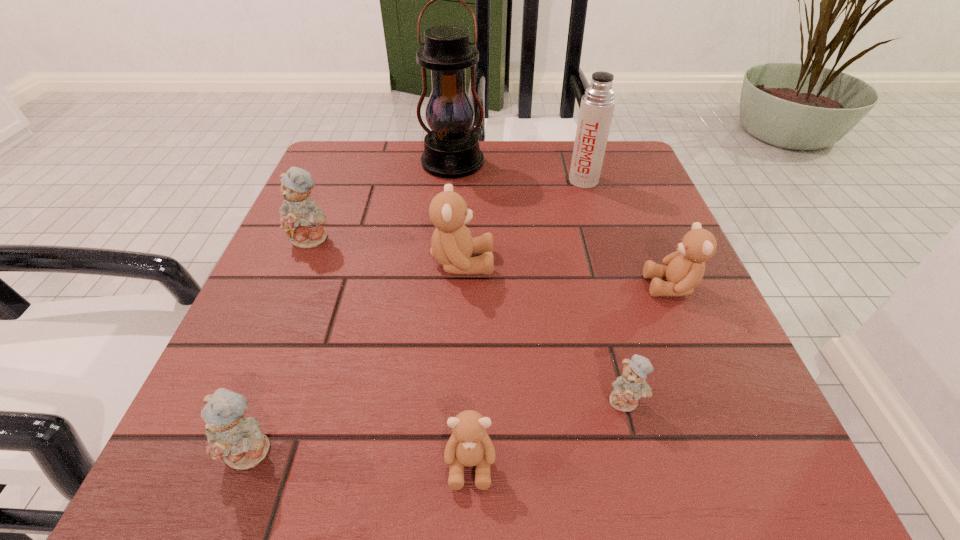
Find the location of a particular element. lantern is located at coordinates (451, 149).

This screenshot has width=960, height=540. In order to click on black lantern in this screenshot , I will do 451,149.

At what (x,y) coordinates should I click in order to perform the action: click on the second tallest object. Please return your answer as a coordinate pair (x, y). The image size is (960, 540). Looking at the image, I should click on (597, 106).

At what (x,y) coordinates should I click in order to perform the action: click on the biggest brown teddy bear. Please return your answer as a coordinate pair (x, y). Looking at the image, I should click on (452, 245).

Where is `the biggest blue teddy bear`? This screenshot has height=540, width=960. the biggest blue teddy bear is located at coordinates (301, 219).

What are the coordinates of `the second biggest brown teddy bear` in the screenshot? It's located at (684, 269).

Find the location of `the rightmost teddy bear`. the rightmost teddy bear is located at coordinates (684, 269).

Where is `the second biggest blue teddy bear`? the second biggest blue teddy bear is located at coordinates (239, 440).

You are a GUI agent. You are given a task and a screenshot of the screen. Output one action in this format:
    pyautogui.click(x=<x>, y=<y>)
    Task: Click on the smallest blue teddy bear
    This screenshot has height=540, width=960.
    Given the screenshot: What is the action you would take?
    pyautogui.click(x=627, y=389)

I want to click on the rightmost blue teddy bear, so click(627, 389).